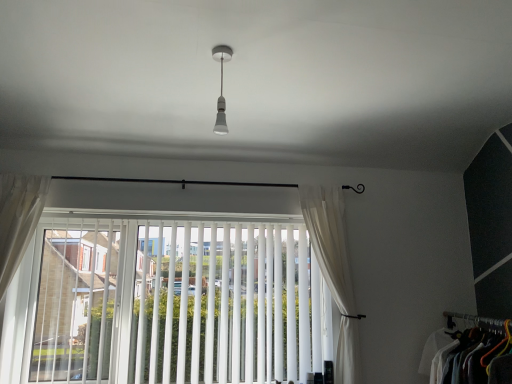
Question: Does white vertical blinds at center have a larger size compared to matte white light bulb at center?

Choices:
 (A) yes
 (B) no

Answer: (A)

Question: Is white vertical blinds at center turned away from matte white light bulb at center?

Choices:
 (A) yes
 (B) no

Answer: (B)

Question: Is matte white light bulb at center inside white vertical blinds at center?

Choices:
 (A) yes
 (B) no

Answer: (B)

Question: From a real-world perspective, is white vertical blinds at center physically below matte white light bulb at center?

Choices:
 (A) no
 (B) yes

Answer: (B)

Question: Is white vertical blinds at center not within matte white light bulb at center?

Choices:
 (A) yes
 (B) no

Answer: (A)

Question: Considering the relative sizes of white vertical blinds at center and matte white light bulb at center in the image provided, is white vertical blinds at center thinner than matte white light bulb at center?

Choices:
 (A) yes
 (B) no

Answer: (B)

Question: Would you say white sheer curtain at right, which appears as the first curtain when viewed from the right, is part of white fabric clothes at lower right's contents?

Choices:
 (A) yes
 (B) no

Answer: (B)

Question: Can you confirm if white fabric clothes at lower right is positioned to the left of white sheer curtain at right, which appears as the first curtain when viewed from the right?

Choices:
 (A) no
 (B) yes

Answer: (A)

Question: Is white fabric clothes at lower right positioned behind white sheer curtain at right, arranged as the second curtain when viewed from the left?

Choices:
 (A) yes
 (B) no

Answer: (B)

Question: Can you confirm if white fabric clothes at lower right is smaller than white sheer curtain at right, which appears as the first curtain when viewed from the right?

Choices:
 (A) no
 (B) yes

Answer: (A)

Question: Is white fabric clothes at lower right not near white sheer curtain at right, arranged as the second curtain when viewed from the left?

Choices:
 (A) yes
 (B) no

Answer: (B)

Question: Is the depth of white fabric clothes at lower right less than that of white sheer curtain at right, which appears as the first curtain when viewed from the right?

Choices:
 (A) yes
 (B) no

Answer: (A)

Question: Is matte white light bulb at center not within white sheer curtain at left, acting as the first curtain starting from the left?

Choices:
 (A) no
 (B) yes

Answer: (B)